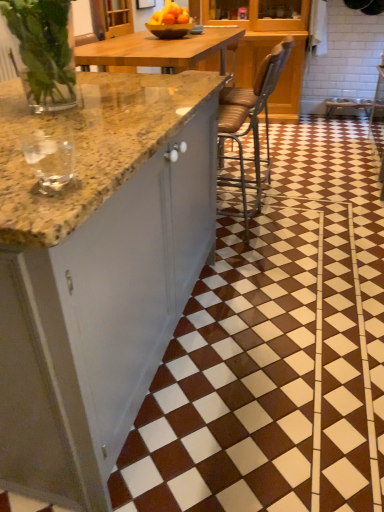
You are a GUI agent. You are given a task and a screenshot of the screen. Output one action in this format:
    pyautogui.click(x=<x>, y=<y>)
    Task: Click on the free space in front of brown leather chair at center
    This screenshot has width=384, height=512.
    Given the screenshot: What is the action you would take?
    coord(257,263)